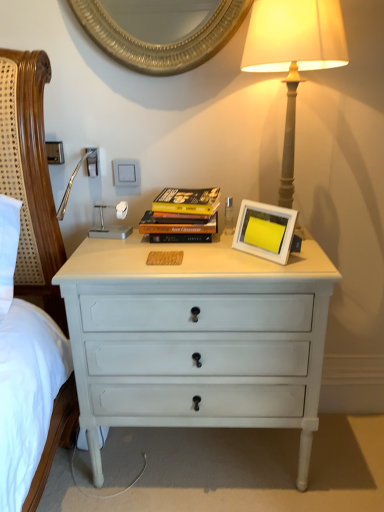
What are the coordinates of `vacant space situated on the left part of white matte picture frame at center` in the screenshot? It's located at (216, 254).